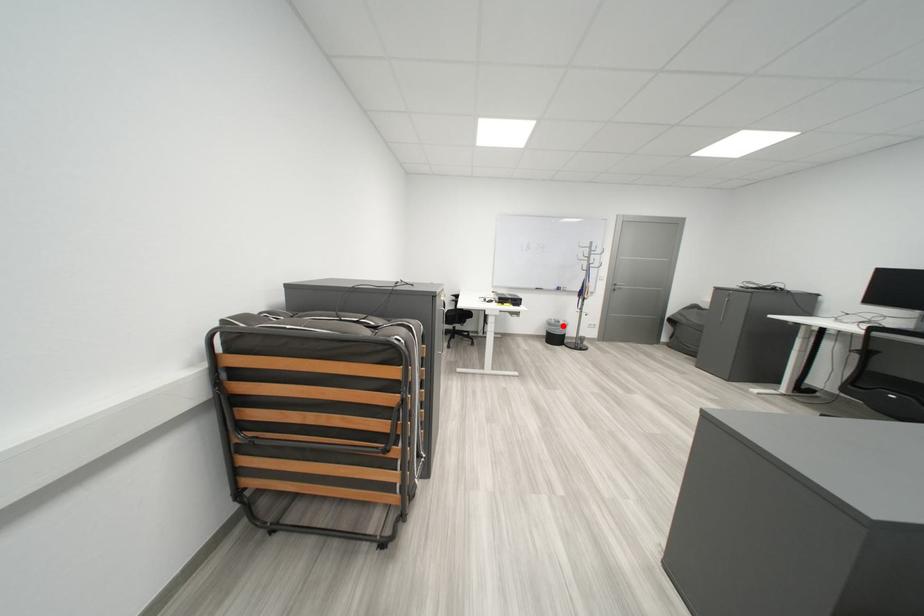
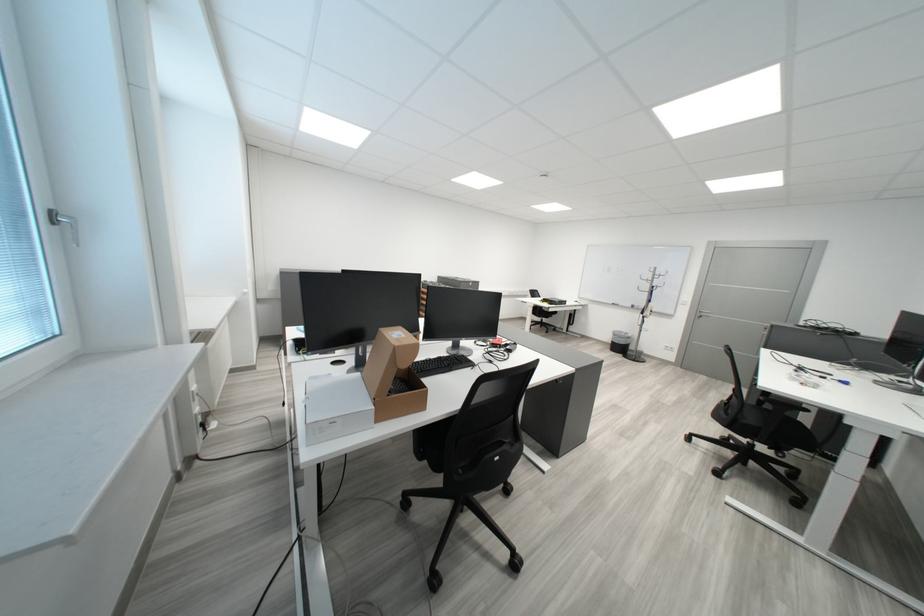
Question: A red point is marked in image1. In image2, is the corresponding 3D point closer to the camera or farther? Reply with the corresponding letter.

Choices:
 (A) The corresponding 3D point is closer.
 (B) The corresponding 3D point is farther.

Answer: (A)